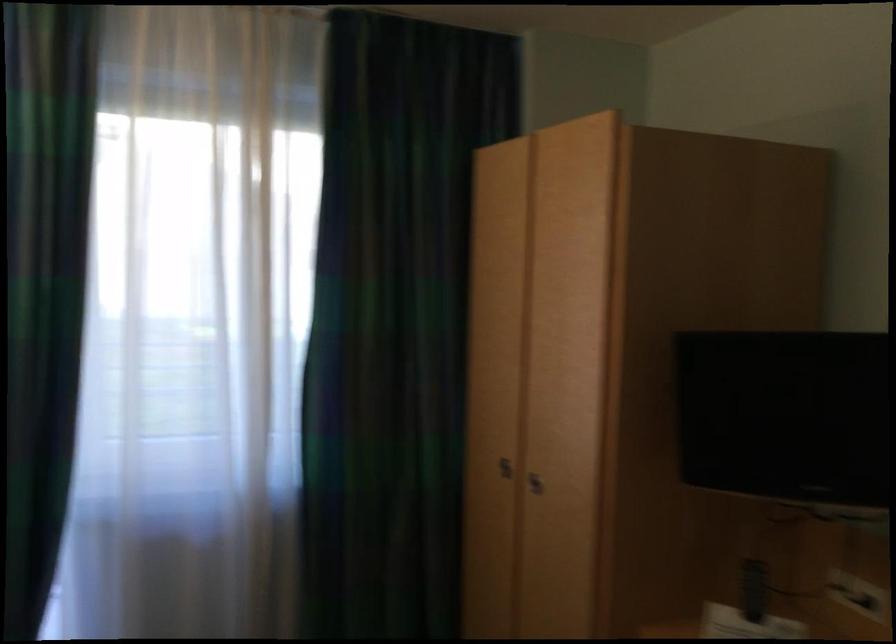
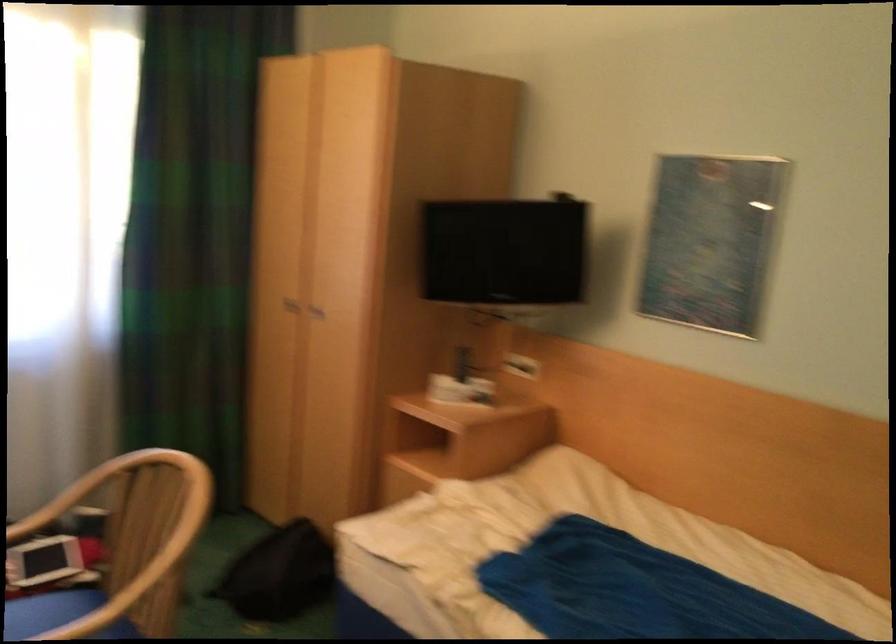
Question: What movement of the cameraman would produce the second image?

Choices:
 (A) Left
 (B) Right
 (C) Forward
 (D) Backward

Answer: (D)